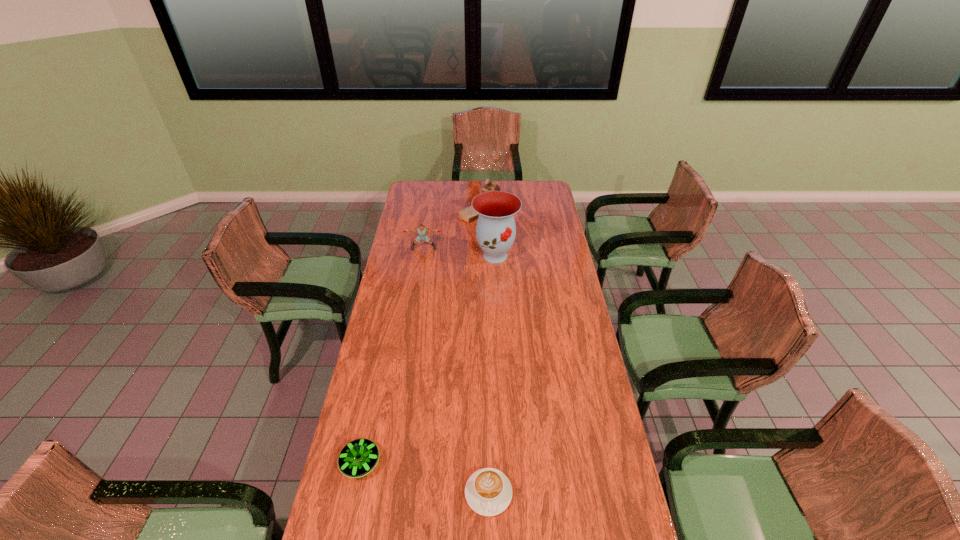
Locate an element on the screen. The width and height of the screenshot is (960, 540). free space between the third shortest object and the cappuccino is located at coordinates (456, 370).

The image size is (960, 540). Identify the location of unoccupied position between the cappuccino and the tallest object. (492, 374).

Locate an element on the screen. The height and width of the screenshot is (540, 960). free spot between the saucer and the puncher is located at coordinates (392, 355).

Find the location of a particular element. The height and width of the screenshot is (540, 960). unoccupied area between the cappuccino and the saucer is located at coordinates (424, 478).

The image size is (960, 540). Identify the location of unoccupied position between the third shortest object and the saucer. (392, 355).

Where is `free spot between the cappuccino and the third shortest object`? Image resolution: width=960 pixels, height=540 pixels. free spot between the cappuccino and the third shortest object is located at coordinates (456, 370).

At what (x,y) coordinates should I click in order to perform the action: click on free space that is in between the saucer and the vase. Please return your answer as a coordinate pair (x, y). Looking at the image, I should click on (428, 359).

Where is `free space between the saucer and the tallest object`? The image size is (960, 540). free space between the saucer and the tallest object is located at coordinates (428, 359).

Locate an element on the screen. The height and width of the screenshot is (540, 960). unoccupied position between the cappuccino and the saucer is located at coordinates (424, 478).

At what (x,y) coordinates should I click in order to perform the action: click on the closest object relative to the saucer. Please return your answer as a coordinate pair (x, y). This screenshot has width=960, height=540. Looking at the image, I should click on (488, 491).